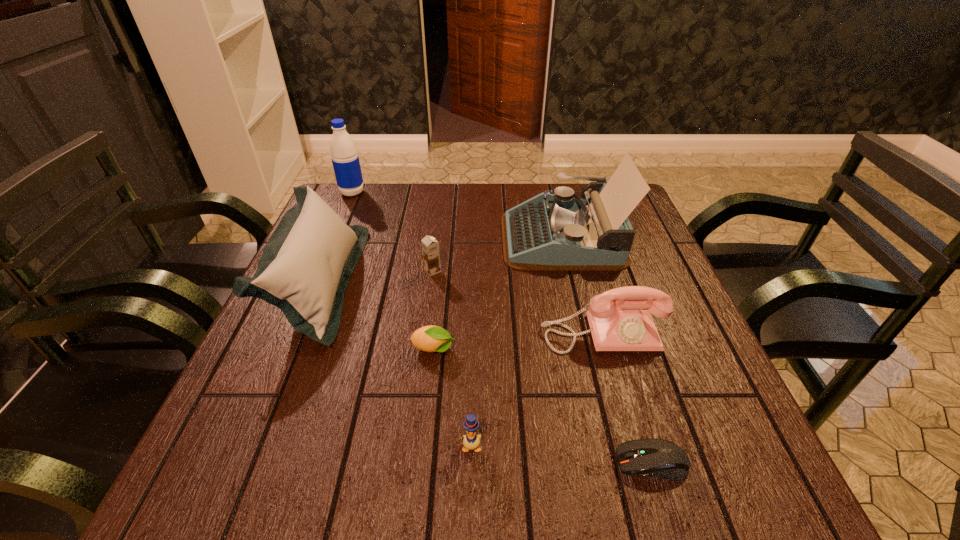
The image size is (960, 540). Identify the location of vacant region located 0.370m on the button of the shortest object. point(393,462).

This screenshot has width=960, height=540. I want to click on water bottle positioned at the far edge, so click(x=345, y=159).

Locate an element on the screen. This screenshot has width=960, height=540. typewriter present at the far edge is located at coordinates (550, 232).

This screenshot has height=540, width=960. In order to click on duckling that is at the near edge in this screenshot , I will do `click(471, 441)`.

Locate an element on the screen. computer equipment at the near edge is located at coordinates (659, 458).

Where is `water bottle that is at the left edge`? This screenshot has width=960, height=540. water bottle that is at the left edge is located at coordinates (345, 159).

Where is `cushion at the left edge`? This screenshot has width=960, height=540. cushion at the left edge is located at coordinates (304, 269).

This screenshot has width=960, height=540. In order to click on typewriter located in the right edge section of the desktop in this screenshot , I will do `click(550, 232)`.

This screenshot has width=960, height=540. In order to click on telephone positioned at the right edge in this screenshot , I will do `click(621, 325)`.

This screenshot has height=540, width=960. What are the coordinates of `computer equipment at the right edge` in the screenshot? It's located at (659, 458).